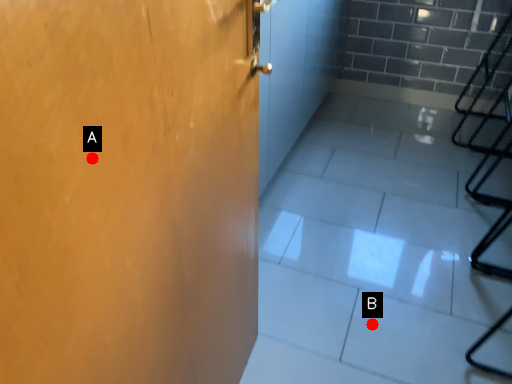
Question: Two points are circled on the image, labeled by A and B beside each circle. Which of the following is the farthest from the observer?

Choices:
 (A) A is further
 (B) B is further

Answer: (B)